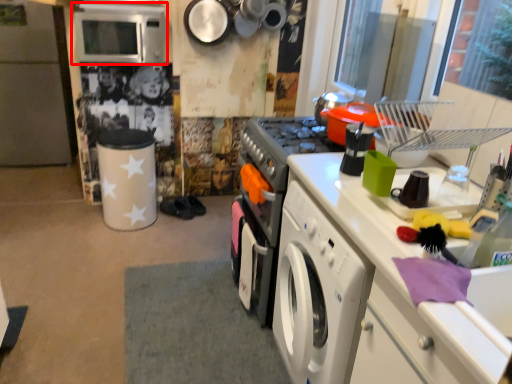
Question: Where is microwave oven (annotated by the red box) located in relation to fridge in the image?

Choices:
 (A) left
 (B) right

Answer: (B)